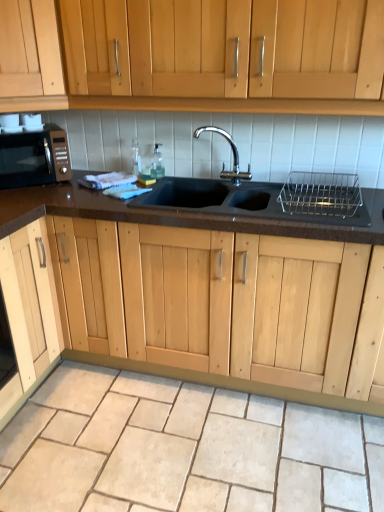
Question: In terms of size, does metallic silver dish rack at upper right appear bigger or smaller than black granite sink at center?

Choices:
 (A) small
 (B) big

Answer: (A)

Question: In the image, is metallic silver dish rack at upper right positioned in front of or behind black granite sink at center?

Choices:
 (A) behind
 (B) front

Answer: (A)

Question: Which is farther from the clear glass bottle at sink, which is the 2th bottle from left to right?

Choices:
 (A) light wood cabinet at upper left
 (B) black granite sink at center
 (C) matte black microwave at left
 (D) clear glass bottle at sink, which is the 1th bottle from left to right
 (E) beige stone granite at lower center

Answer: (E)

Question: Estimate the real-world distances between objects in this image. Which object is farther from the beige stone granite at lower center?

Choices:
 (A) matte black microwave at left
 (B) clear glass bottle at sink, which is the 1th bottle from left to right
 (C) light wood cabinet at upper left
 (D) black granite sink at center
 (E) metallic silver dish rack at upper right

Answer: (C)